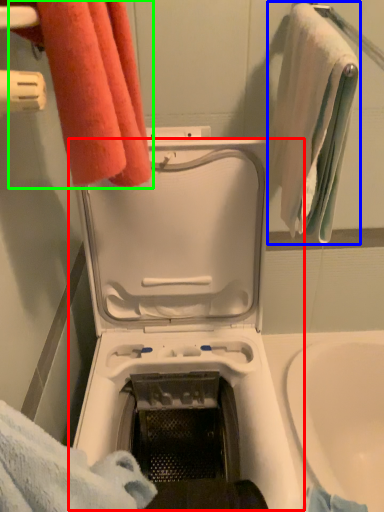
Question: Considering the real-world distances, which object is closest to washing machine (highlighted by a red box)? towel (highlighted by a blue box) or towel (highlighted by a green box).

Choices:
 (A) towel
 (B) towel

Answer: (A)